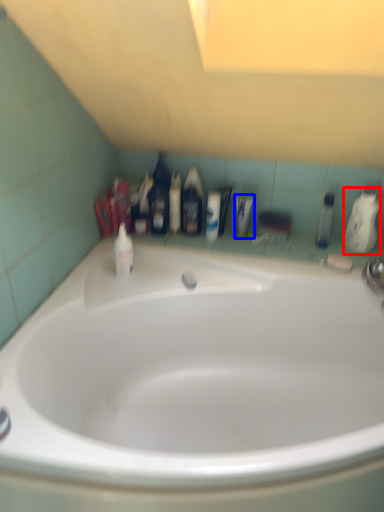
Question: Which object appears closest to the camera in this image, mouthwash (highlighted by a red box) or toiletry (highlighted by a blue box)?

Choices:
 (A) mouthwash
 (B) toiletry

Answer: (A)